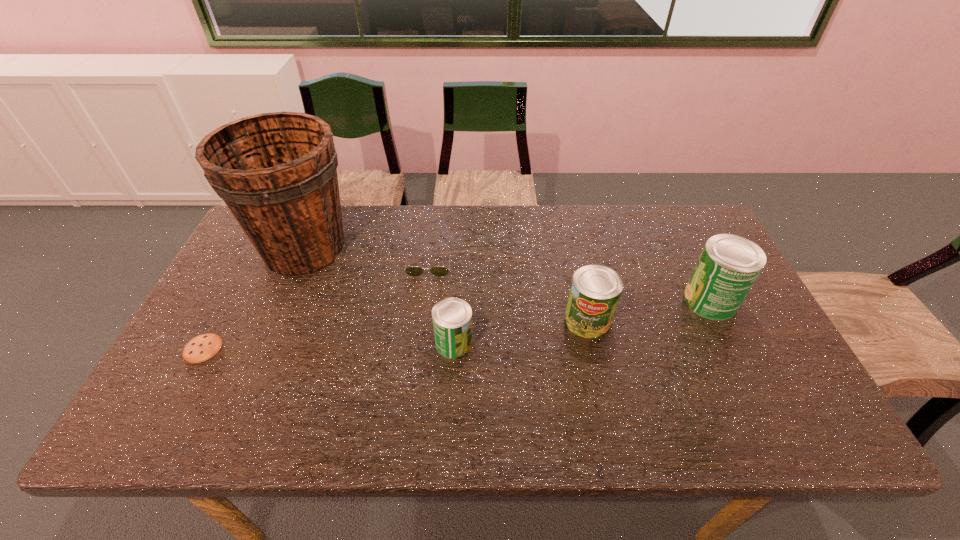
In order to click on free space for a new can on the left in this screenshot , I will do `click(307, 368)`.